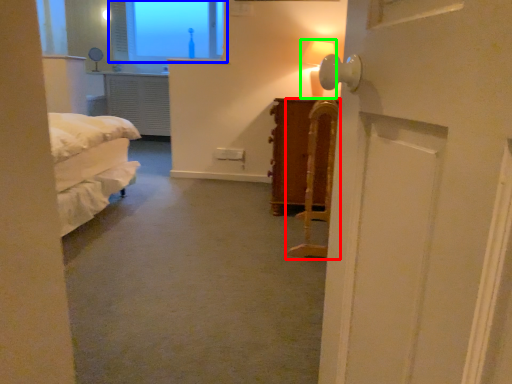
Question: Considering the real-world distances, which object is closest to furniture (highlighted by a red box)? window (highlighted by a blue box) or table lamp (highlighted by a green box).

Choices:
 (A) window
 (B) table lamp

Answer: (B)